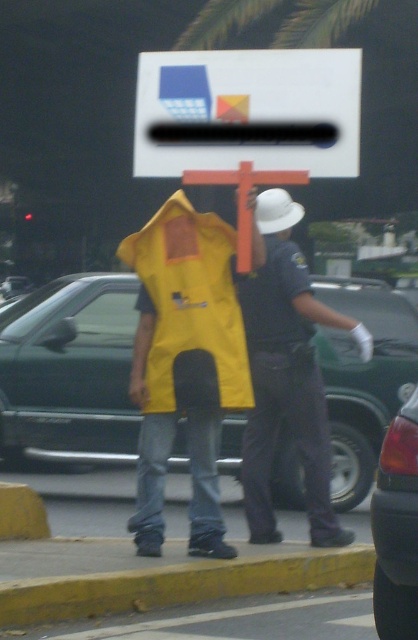
Between matte plastic sign at center and yellow painted curb at lower center, which one is positioned higher?

Positioned higher is matte plastic sign at center.

Does matte plastic sign at center have a greater width compared to yellow painted curb at lower center?

No, matte plastic sign at center is not wider than yellow painted curb at lower center.

You are a GUI agent. You are given a task and a screenshot of the screen. Output one action in this format:
    pyautogui.click(x=<x>, y=<y>)
    Task: Click on the matte plastic sign at center
    The height and width of the screenshot is (640, 418).
    Given the screenshot: What is the action you would take?
    pyautogui.click(x=247, y=112)

Is the position of matte yellow vest at center more distant than that of orange painted wooden cross at center?

Yes, matte yellow vest at center is behind orange painted wooden cross at center.

Between matte yellow vest at center and orange painted wooden cross at center, which one is positioned lower?

matte yellow vest at center is lower down.

Which is in front, point (254, 346) or point (262, 182)?

Positioned in front is point (262, 182).

What are the coordinates of `matte yellow vest at center` in the screenshot? It's located at (288, 376).

Can you confirm if glossy plastic car at lower right is bigger than orange painted wooden cross at center?

Indeed, glossy plastic car at lower right has a larger size compared to orange painted wooden cross at center.

Does glossy plastic car at lower right have a lesser width compared to orange painted wooden cross at center?

Correct, glossy plastic car at lower right's width is less than orange painted wooden cross at center's.

Which is behind, point (412, 576) or point (244, 168)?

Point (244, 168)

You are a GUI agent. You are given a task and a screenshot of the screen. Output one action in this format:
    pyautogui.click(x=<x>, y=<y>)
    Task: Click on the glossy plastic car at lower right
    This screenshot has width=418, height=640.
    Given the screenshot: What is the action you would take?
    pyautogui.click(x=397, y=529)